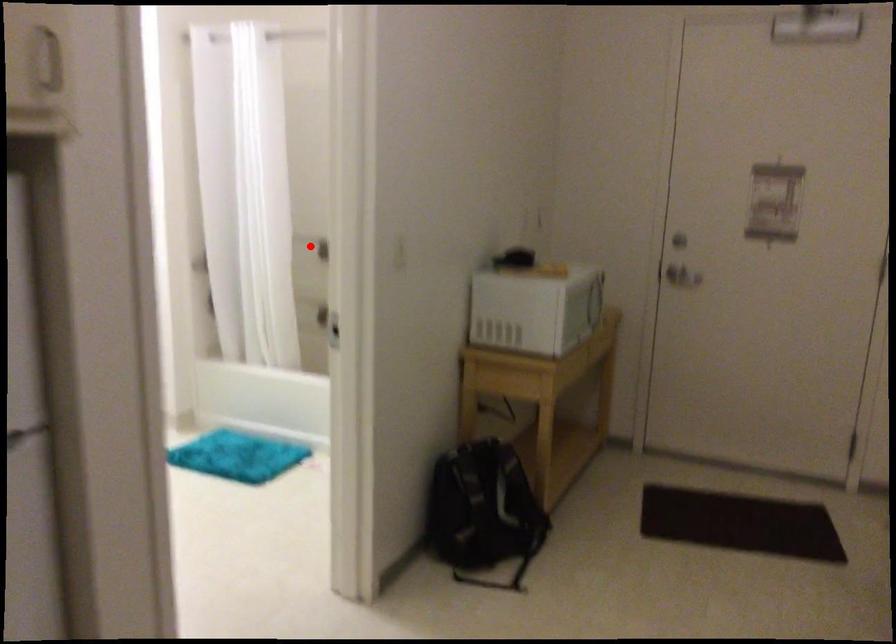
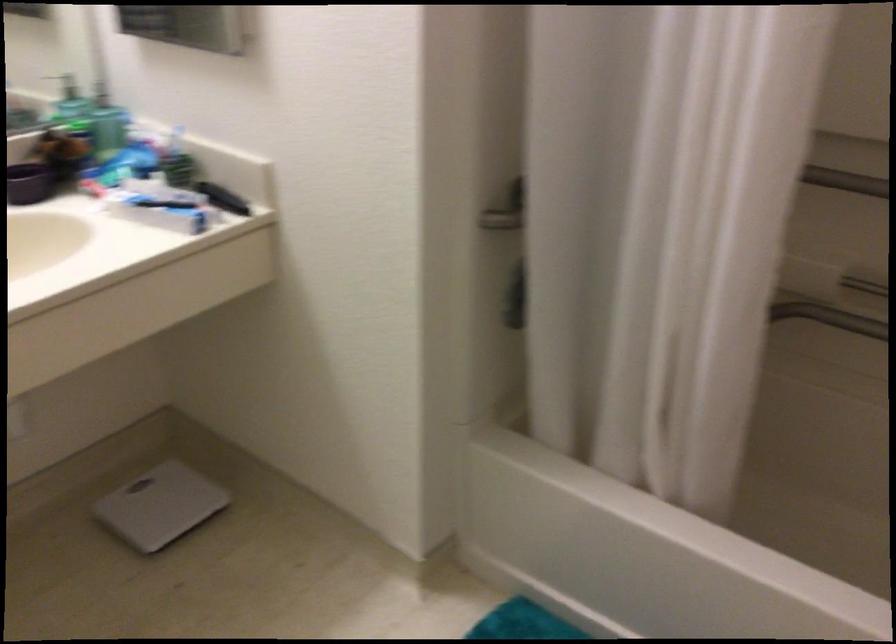
Question: I am providing you with two images of the same scene from different viewpoints. A red point is marked on the first image. Is the red point's position out of view in image 2?

Choices:
 (A) Yes
 (B) No

Answer: (A)